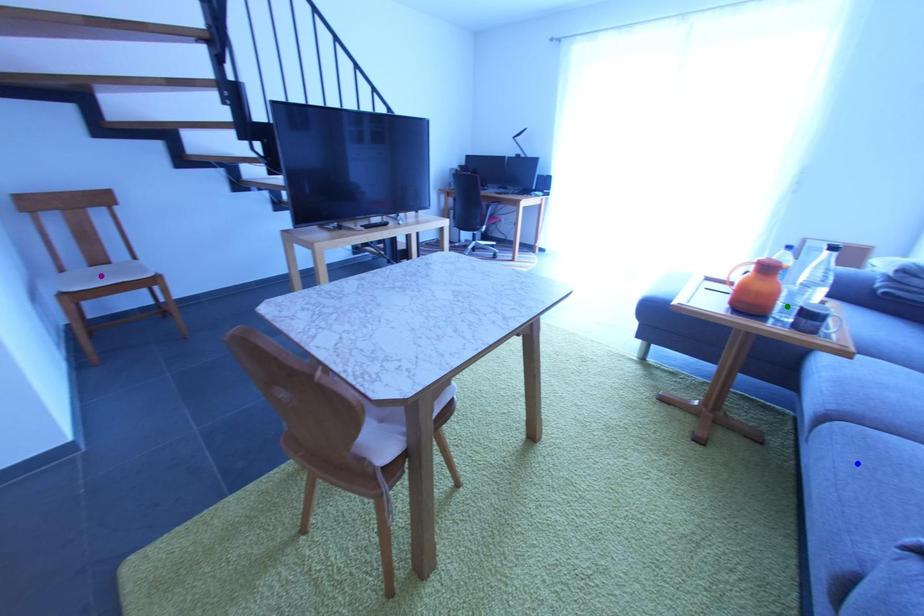
Order these from nearest to farthest:
purple point, blue point, green point

1. blue point
2. green point
3. purple point